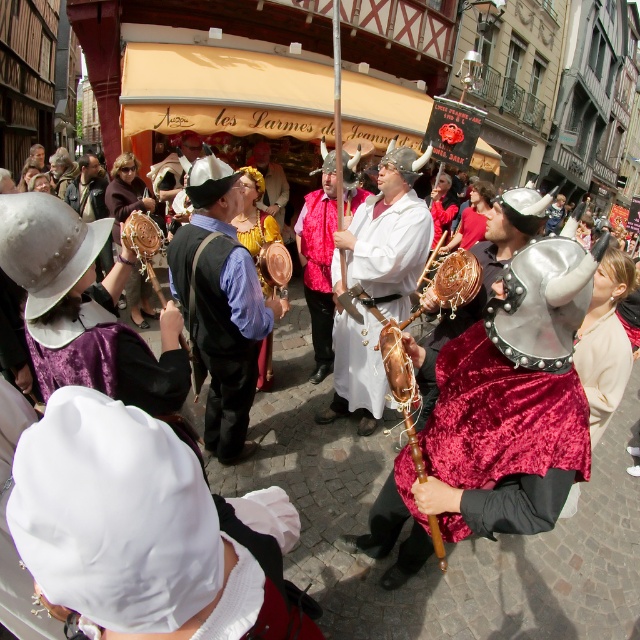
You are an observer standing on the cobblestone street. You notice two headpieces in the scene. The first is the white satin bonnet at lower left, and the second is the velvet fabric hat at center. Which of these two headpieces is located lower in the image?

The white satin bonnet at lower left is positioned under the velvet fabric hat at center, so it is located lower in the image.

You are a costume designer observing the lively street scene. You need to determine which object occupies more space in the scene between the white fabric robe at center and the leather drum at center. Which one is bigger?

The white fabric robe at center is larger in size than the leather drum at center, so the white fabric robe at center occupies more space in the scene.

You are a festival attendee standing on the cobblestone street and see both the shiny gold instrument at center and the gold textured crown at center. Which object is positioned lower from the ground?

The shiny gold instrument at center is located below the gold textured crown at center, so it is positioned lower from the ground.